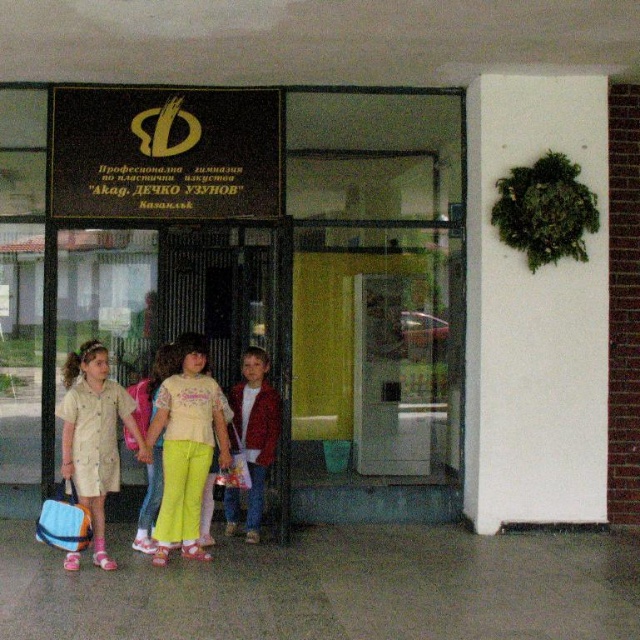
You are a photographer standing at the entrance of the building and want to take a closeup photo of the beige cotton dress at center. Considering the distance, can you capture the dress clearly without moving closer?

The beige cotton dress at center is 5.88 meters away from the viewer. A standard camera lens can focus on subjects at this distance, so yes, you can capture the dress clearly without moving closer.

Please provide the 2D coordinates of the light yellow cotton shirt at center in the image.

The 2D coordinates of the light yellow cotton shirt at center are at point (186, 448).